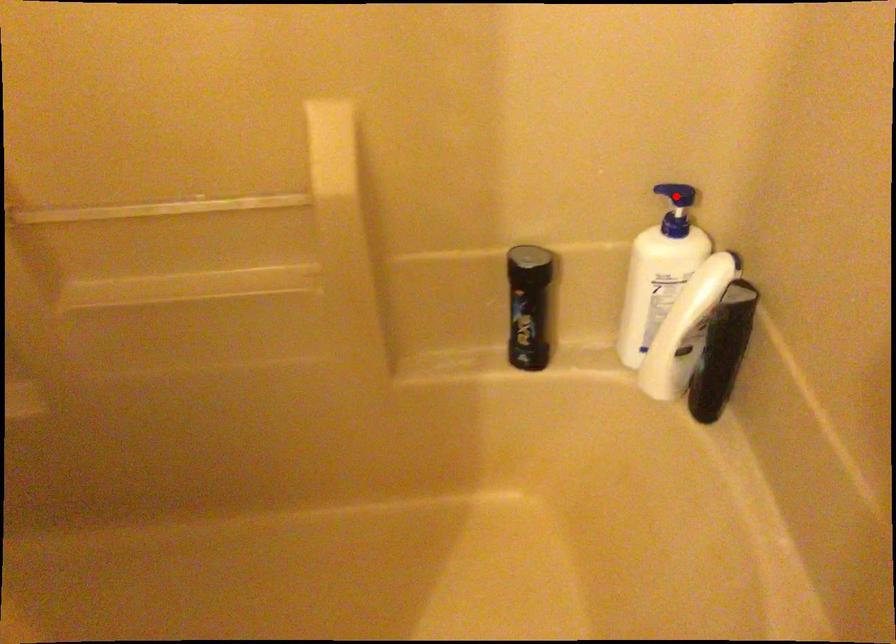
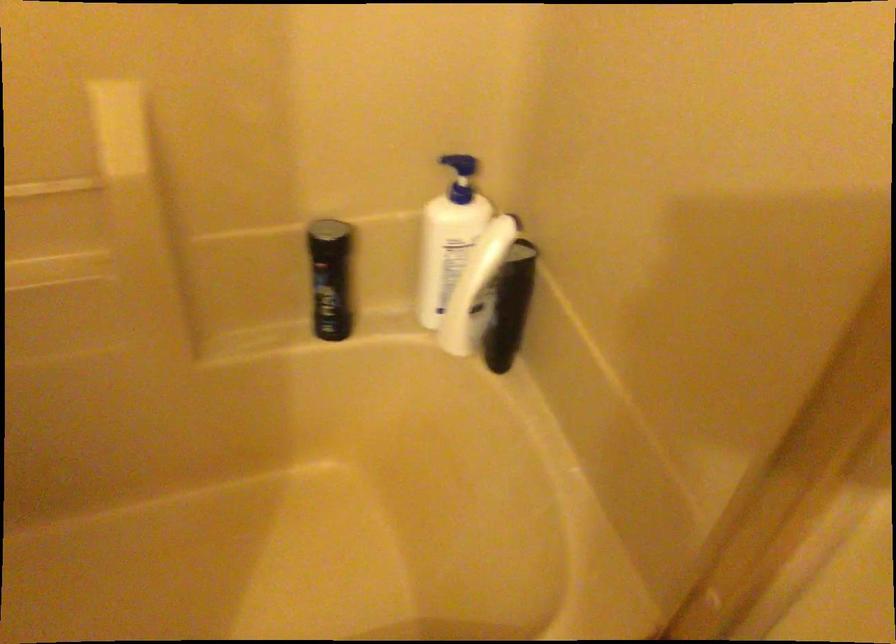
Where in the second image is the point corresponding to the highlighted location from the first image?

(460, 166)